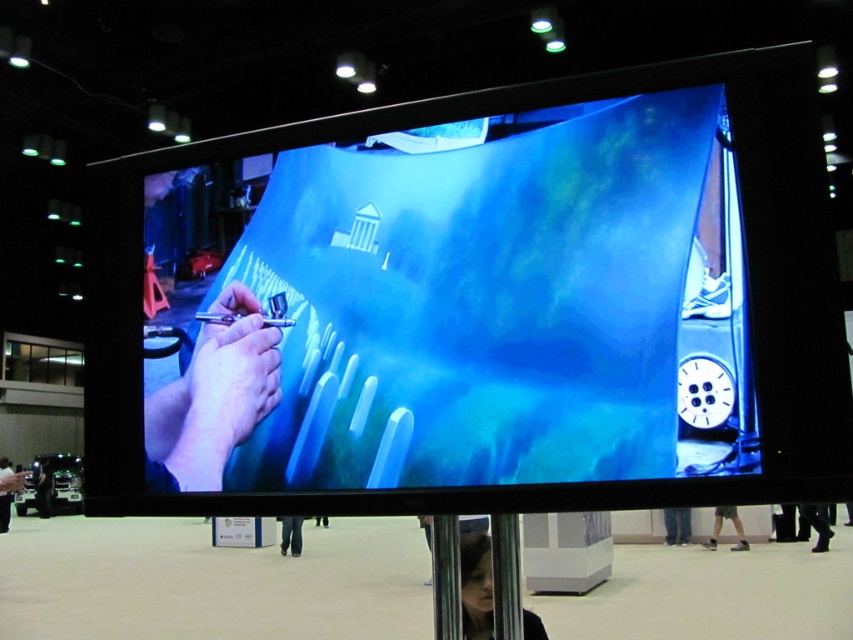
Is blue matte painting at center taller than metallic silver pole at lower center?

Correct, blue matte painting at center is much taller as metallic silver pole at lower center.

Between blue matte painting at center and metallic silver pole at lower center, which one is positioned lower?

Positioned lower is metallic silver pole at lower center.

Is point (421, 472) positioned in front of point (437, 609)?

Yes, point (421, 472) is in front of point (437, 609).

Find the location of a particular element. Image resolution: width=853 pixels, height=640 pixels. blue matte painting at center is located at coordinates pos(454,305).

This screenshot has height=640, width=853. I want to click on smooth skin hands at center, so click(215, 394).

Can you confirm if smooth skin hands at center is wider than smooth skin face at lower center?

No, smooth skin hands at center is not wider than smooth skin face at lower center.

Identify the location of smooth skin hands at center. (215, 394).

Where is `smooth skin hands at center`? The height and width of the screenshot is (640, 853). smooth skin hands at center is located at coordinates (215, 394).

Is the position of blue matte painting at center more distant than that of black leather pants at lower center?

No, blue matte painting at center is closer to the viewer.

You are a GUI agent. You are given a task and a screenshot of the screen. Output one action in this format:
    pyautogui.click(x=<x>, y=<y>)
    Task: Click on the blue matte painting at center
    Image resolution: width=853 pixels, height=640 pixels.
    Given the screenshot: What is the action you would take?
    pyautogui.click(x=454, y=305)

I want to click on blue matte painting at center, so click(454, 305).